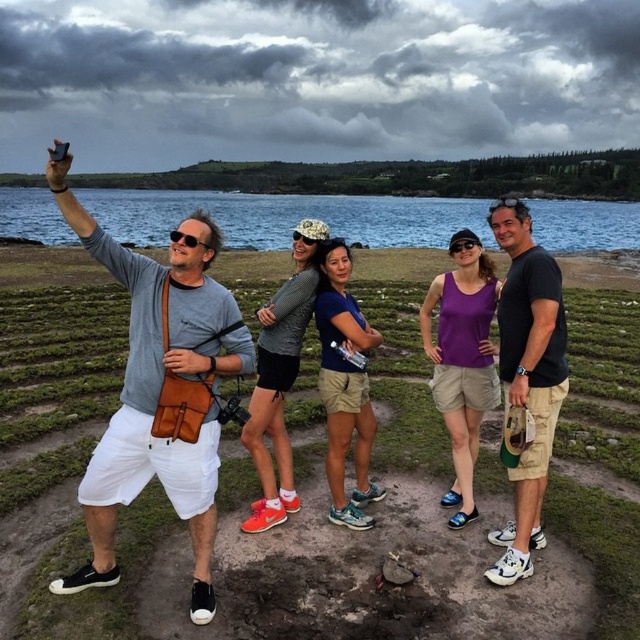
You are trying to take a selfie with your friends and want to ensure that both the matte brown bag at left and the matte black sunglasses at center are clearly visible in the frame. Based on their positions, which object should you focus on first to ensure both are in focus?

You should focus on the matte brown bag at left first because it is closer to the viewer than the matte black sunglasses at center. By focusing on the closer object, the sunglasses at center will still be in focus due to the depth of field, ensuring both are clear.

You are standing in the grassy area near the muddy ground and want to take a selfie. You have two points marked on the ground where you can stand to frame the photo. One is at point (x=204, y=218) and the other is at point (x=458, y=250). Which point is closer to you so that you can easily reach your phone to take the selfie?

Point (x=204, y=218) is closer to the viewer than point (x=458, y=250), so you should stand at point (x=204, y=218) to easily reach your phone.

You are standing in the scene and want to take a photo of the two people wearing purple matte tank top at center and matte gray tank top at center. Which one should you point the camera towards first if you want to capture them from left to right?

You should point the camera towards the matte gray tank top at center first because the purple matte tank top at center is to the right of it, so capturing them left to right would start with the matte gray one then the purple one.